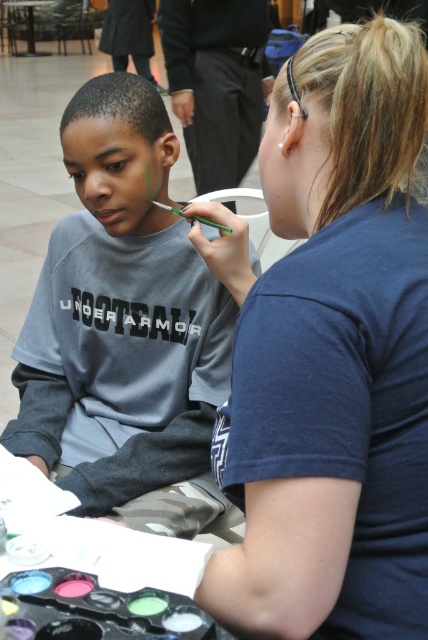
You are a photographer taking a picture of the blue fabric shirt at upper right and the matte gray shirt at left. Which shirt will appear closer to the camera in the photo?

The blue fabric shirt at upper right will appear closer to the camera because it is positioned in front of the matte gray shirt at left.

From the picture: You are a photographer trying to capture a candid shot of the two people in the scene. You want to ensure that both the blue fabric shirt at upper right and the matte gray shirt at left are clearly visible in the frame. Based on their positions and sizes, which shirt should you focus on first to ensure proper exposure?

The blue fabric shirt at upper right is shorter than the matte gray shirt at left, so you should focus on the matte gray shirt at left first since it is larger and might require more attention for proper exposure.

You are a tailor who needs to determine which shirt requires more fabric for alterations. Based on the image, which shirt between the blue fabric shirt at upper right and the matte gray shirt at left would need more fabric due to its larger size?

The matte gray shirt at left requires more fabric because its width is greater than the blue fabric shirt at upper right.